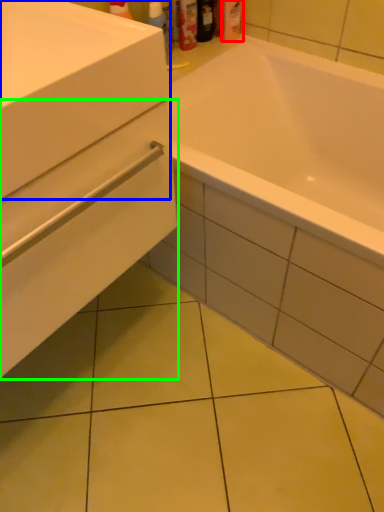
Question: Considering the real-world distances, which object is farthest from toiletry (highlighted by a red box)? sink (highlighted by a blue box) or drawer (highlighted by a green box)?

Choices:
 (A) sink
 (B) drawer

Answer: (B)